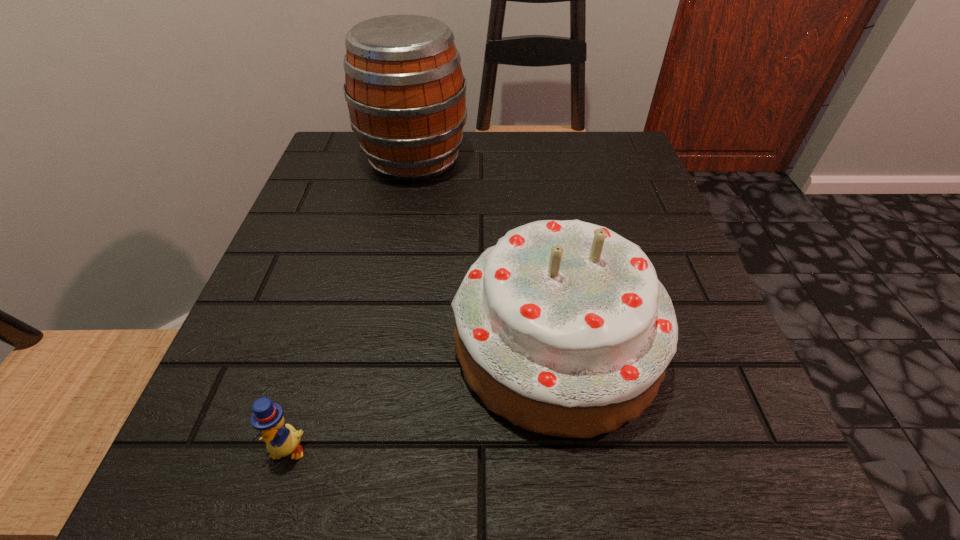
Where is `duckling that is at the left edge`? The width and height of the screenshot is (960, 540). duckling that is at the left edge is located at coordinates (281, 439).

I want to click on object located in the right edge section of the desktop, so click(x=563, y=328).

Where is `object at the far left corner`? The image size is (960, 540). object at the far left corner is located at coordinates (406, 94).

Find the location of a particular element. The width and height of the screenshot is (960, 540). object that is positioned at the near left corner is located at coordinates (281, 439).

At what (x,y) coordinates should I click in order to perform the action: click on object located at the near right corner. Please return your answer as a coordinate pair (x, y). The height and width of the screenshot is (540, 960). Looking at the image, I should click on (563, 328).

Where is `vacant space at the near edge of the desktop`? vacant space at the near edge of the desktop is located at coordinates (357, 486).

Locate an element on the screen. The height and width of the screenshot is (540, 960). free space at the left edge of the desktop is located at coordinates (286, 232).

Where is `free space at the right edge of the desktop`? free space at the right edge of the desktop is located at coordinates tap(664, 379).

Locate an element on the screen. The width and height of the screenshot is (960, 540). free spot at the far left corner of the desktop is located at coordinates (340, 168).

In the image, there is a desktop. At what (x,y) coordinates should I click in order to perform the action: click on blank space at the near right corner. Please return your answer as a coordinate pair (x, y). The image size is (960, 540). Looking at the image, I should click on (731, 510).